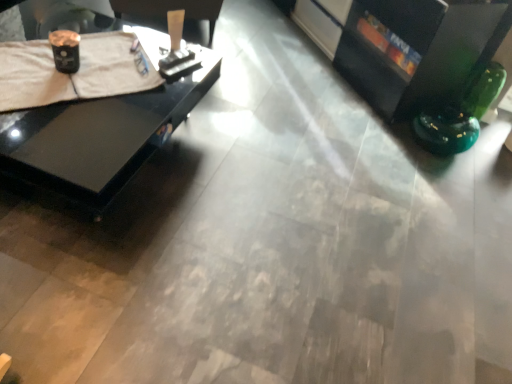
Question: Does white cloth at upper left have a lesser width compared to black glossy table at left?

Choices:
 (A) no
 (B) yes

Answer: (B)

Question: Is black glossy table at left located within white cloth at upper left?

Choices:
 (A) no
 (B) yes

Answer: (A)

Question: Is white cloth at upper left located outside black glossy table at left?

Choices:
 (A) yes
 (B) no

Answer: (B)

Question: Does white cloth at upper left appear on the right side of black glossy table at left?

Choices:
 (A) yes
 (B) no

Answer: (A)

Question: From the image's perspective, does white cloth at upper left appear higher than black glossy table at left?

Choices:
 (A) yes
 (B) no

Answer: (A)

Question: Based on their sizes in the image, would you say white cloth at upper left is bigger or smaller than black glossy table at left?

Choices:
 (A) big
 (B) small

Answer: (B)

Question: Considering the positions of point (153, 67) and point (78, 178), is point (153, 67) closer or farther from the camera than point (78, 178)?

Choices:
 (A) closer
 (B) farther

Answer: (B)

Question: Considering their positions, is white cloth at upper left located in front of or behind black glossy table at left?

Choices:
 (A) front
 (B) behind

Answer: (B)

Question: From a real-world perspective, is white cloth at upper left physically located above or below black glossy table at left?

Choices:
 (A) above
 (B) below

Answer: (A)

Question: Is black glossy entertainment center at upper right to the left or to the right of black glossy table at left in the image?

Choices:
 (A) right
 (B) left

Answer: (A)

Question: From a real-world perspective, relative to black glossy table at left, is black glossy entertainment center at upper right vertically above or below?

Choices:
 (A) above
 (B) below

Answer: (A)

Question: Do you think black glossy entertainment center at upper right is within black glossy table at left, or outside of it?

Choices:
 (A) inside
 (B) outside

Answer: (B)

Question: In terms of height, does black glossy entertainment center at upper right look taller or shorter compared to black glossy table at left?

Choices:
 (A) tall
 (B) short

Answer: (A)

Question: From their relative heights in the image, would you say white cloth at upper left is taller or shorter than black glossy entertainment center at upper right?

Choices:
 (A) short
 (B) tall

Answer: (A)

Question: Is white cloth at upper left inside or outside of black glossy entertainment center at upper right?

Choices:
 (A) outside
 (B) inside

Answer: (A)